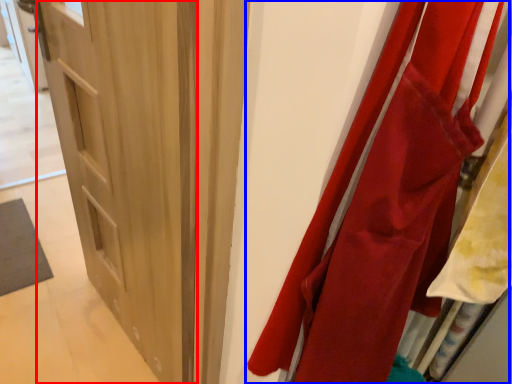
Question: Which point is closer to the camera, door (highlighted by a red box) or curtain (highlighted by a blue box)?

Choices:
 (A) door
 (B) curtain

Answer: (B)